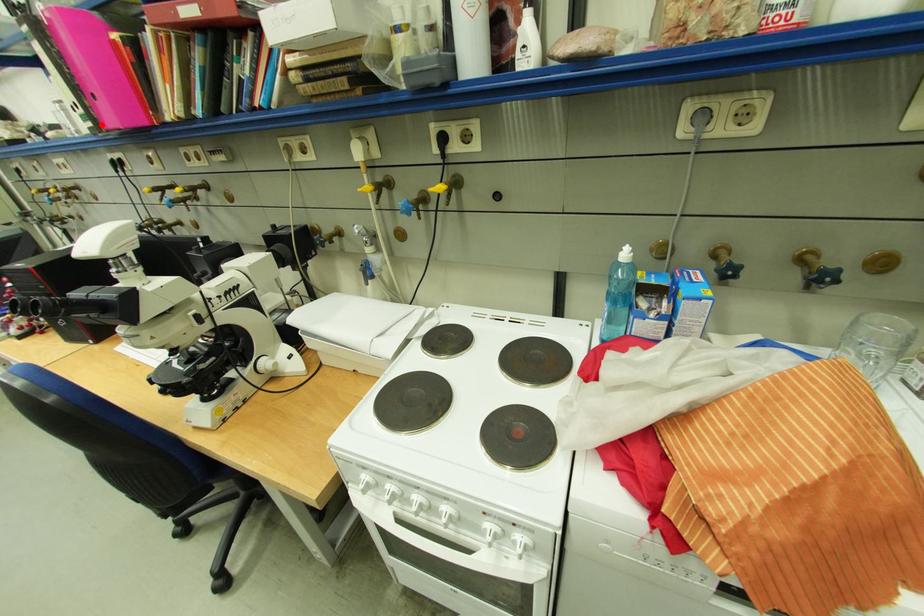
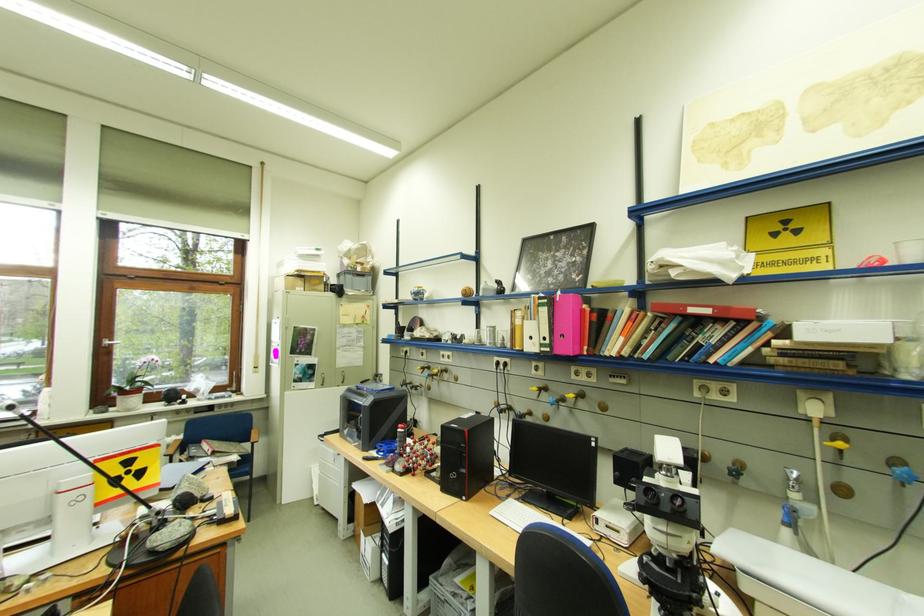
Question: I am providing you with two images of the same scene from different viewpoints. A red point is shown in image1. For the corresponding object point in image2, is it positioned nearer or farther from the camera?

Choices:
 (A) Nearer
 (B) Farther

Answer: (A)